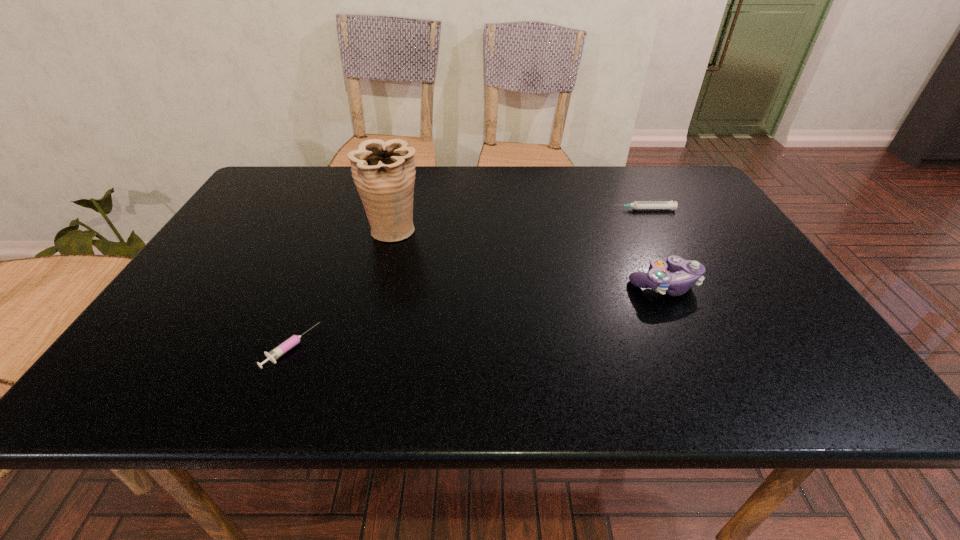
The height and width of the screenshot is (540, 960). Identify the location of free space located 0.290m at the needle end of the farthest object. (512, 209).

The image size is (960, 540). Identify the location of free space located 0.140m at the needle end of the farthest object. (564, 209).

Image resolution: width=960 pixels, height=540 pixels. I want to click on vacant space located 0.200m at the needle end of the farthest object, so click(x=543, y=209).

You are a GUI agent. You are given a task and a screenshot of the screen. Output one action in this format:
    pyautogui.click(x=<x>, y=<y>)
    Task: Click on the free space located 0.050m on the front of the leftmost object
    
    Given the screenshot: What is the action you would take?
    (272, 394)

Locate an element on the screen. Image resolution: width=960 pixels, height=540 pixels. object that is at the near edge is located at coordinates (273, 355).

Image resolution: width=960 pixels, height=540 pixels. Find the location of `object that is at the right edge`. object that is at the right edge is located at coordinates (672, 205).

In the image, there is a desktop. What are the coordinates of `vacant space at the far edge` in the screenshot? It's located at (x=459, y=188).

I want to click on free space at the left edge, so click(247, 221).

What are the coordinates of `vacant space at the right edge` in the screenshot? It's located at (798, 346).

At what (x,y) coordinates should I click in order to perform the action: click on vacant space at the far left corner of the desktop. Please return your answer as a coordinate pair (x, y). The image size is (960, 540). Looking at the image, I should click on (295, 183).